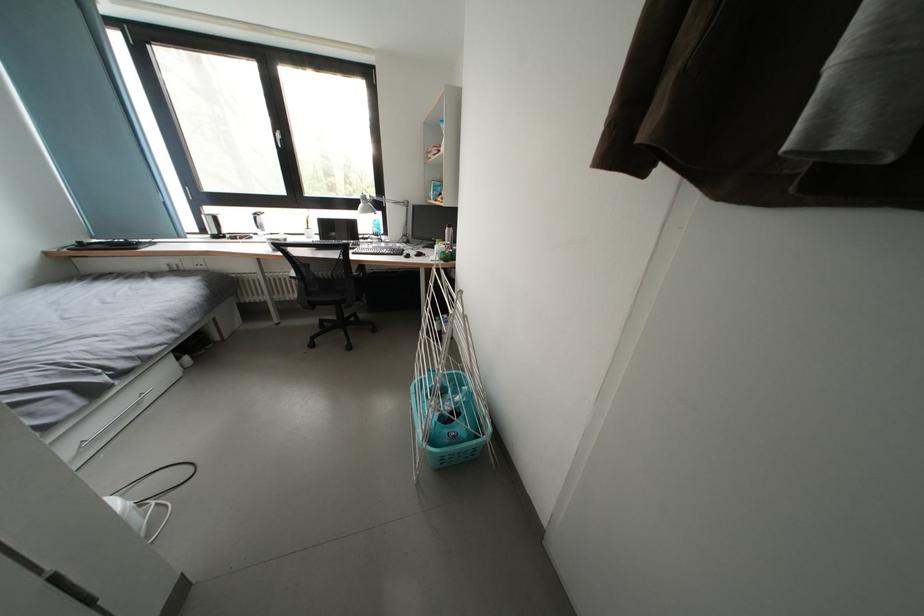
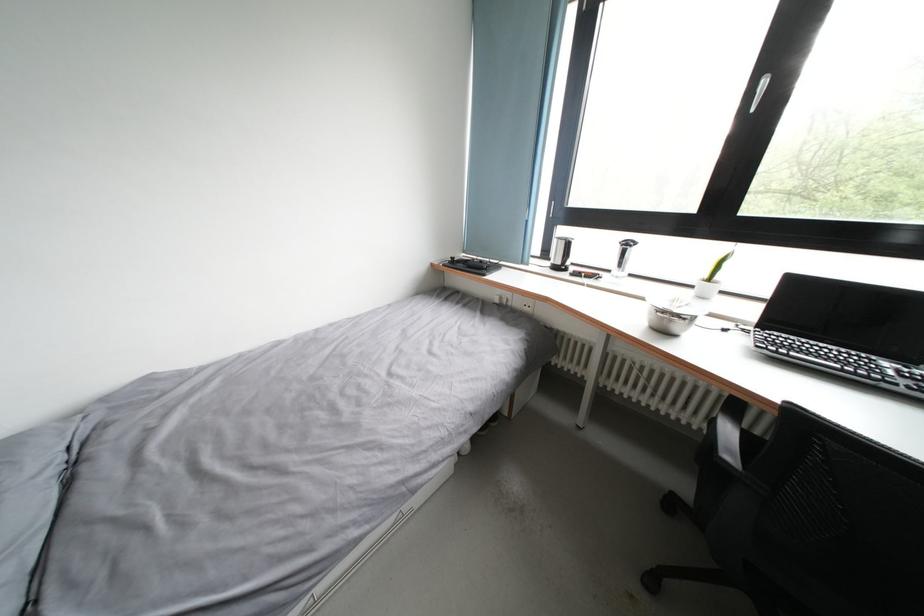
The point at (x=210, y=235) is marked in the first image. Where is the corresponding point in the second image?

(552, 259)